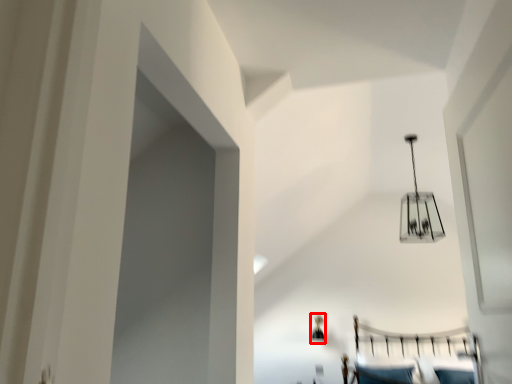
Question: Considering the relative positions of lamp (annotated by the red box) and lamp in the image provided, where is lamp (annotated by the red box) located with respect to the staircase?

Choices:
 (A) left
 (B) right

Answer: (A)